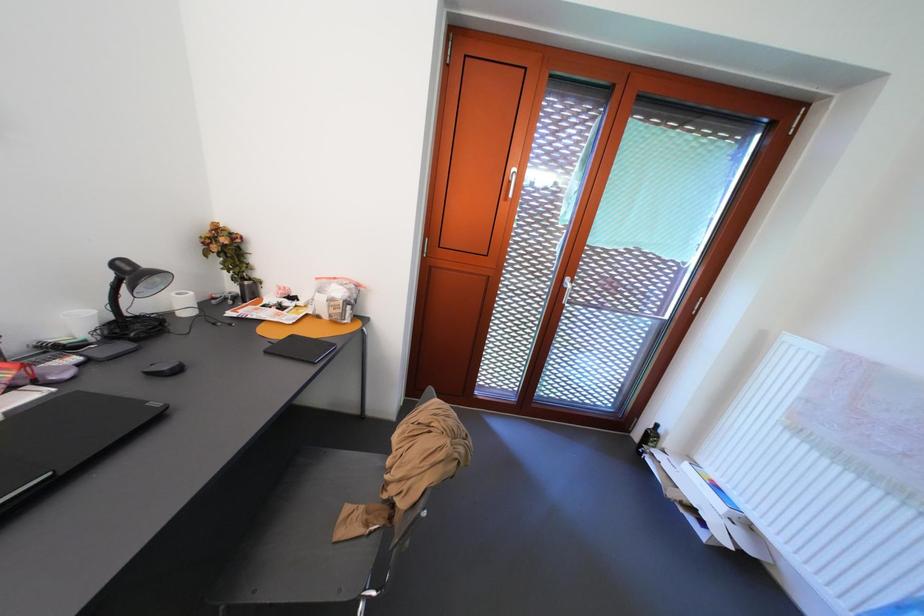
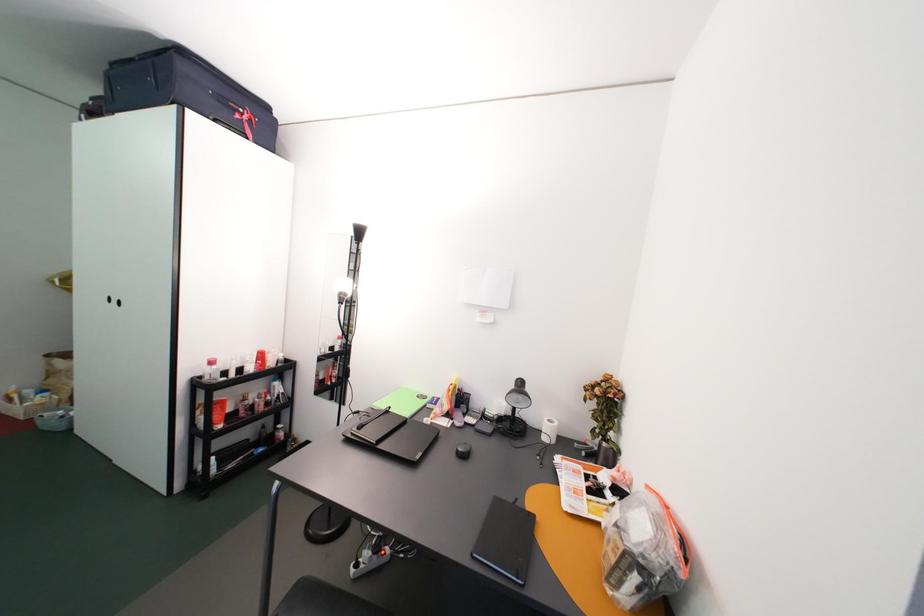
Question: The camera is either moving clockwise (left) or counter-clockwise (right) around the object. The first image is from the beginning of the video and the second image is from the end. Is the camera moving left or right when shooting the video?

Choices:
 (A) Left
 (B) Right

Answer: (B)